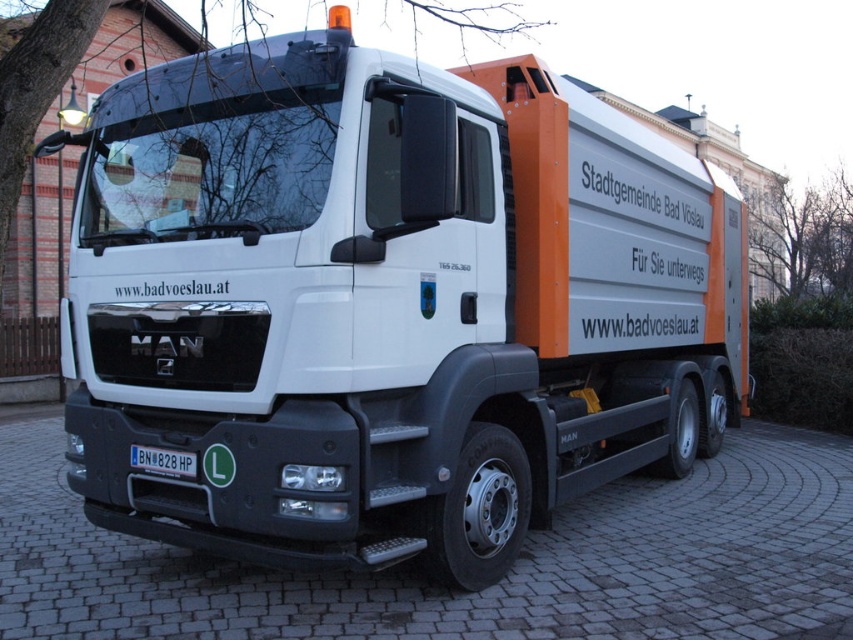
Question: Which object is the closest to the black plastic license plate at lower center?

Choices:
 (A) bare branches at upper right
 (B) bare branches at upper left

Answer: (B)

Question: Where is bare branches at upper left located in relation to bare branches at upper right in the image?

Choices:
 (A) above
 (B) below

Answer: (A)

Question: Is bare branches at upper right wider than black plastic license plate at lower center?

Choices:
 (A) no
 (B) yes

Answer: (B)

Question: Among these objects, which one is nearest to the camera?

Choices:
 (A) bare branches at upper right
 (B) bare branches at upper left

Answer: (B)

Question: Which object is farther from the camera taking this photo?

Choices:
 (A) bare branches at upper left
 (B) bare branches at upper right

Answer: (B)

Question: Does bare branches at upper left have a lesser width compared to bare branches at upper right?

Choices:
 (A) no
 (B) yes

Answer: (A)